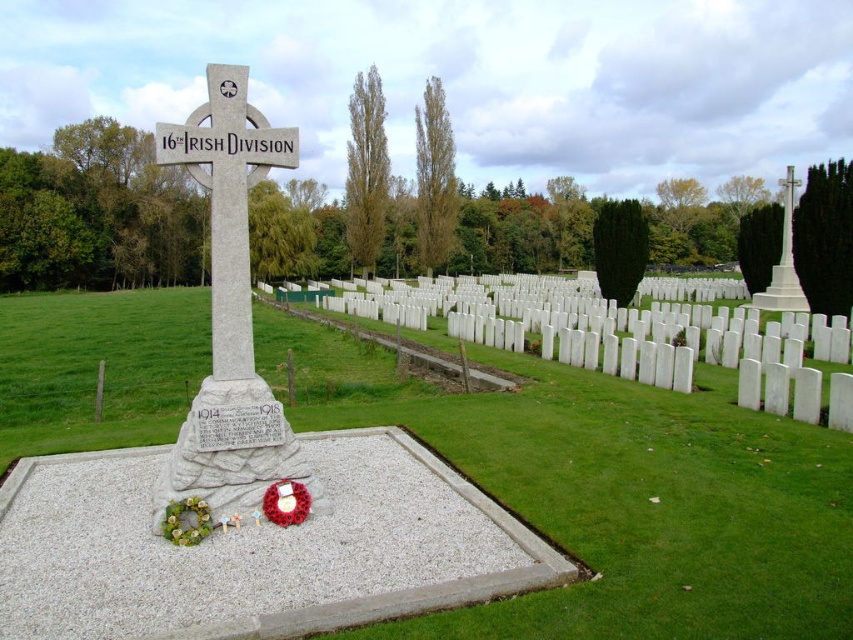
Question: Can you confirm if gray stone cross at center is positioned above red fabric wreath at center?

Choices:
 (A) no
 (B) yes

Answer: (B)

Question: Does gray stone cross at center appear under red fabric wreath at center?

Choices:
 (A) no
 (B) yes

Answer: (A)

Question: Which point is farther to the camera?

Choices:
 (A) red fabric wreath at center
 (B) gray stone cross at center

Answer: (A)

Question: Estimate the real-world distances between objects in this image. Which object is farther from the red fabric wreath at center?

Choices:
 (A) white floral wreath at lower left
 (B) white stone cross at upper right

Answer: (B)

Question: Which object appears closest to the camera in this image?

Choices:
 (A) red fabric wreath at center
 (B) white stone cross at upper right
 (C) gray stone cross at center

Answer: (C)

Question: Is the position of white stone cross at upper right more distant than that of white floral wreath at lower left?

Choices:
 (A) no
 (B) yes

Answer: (B)